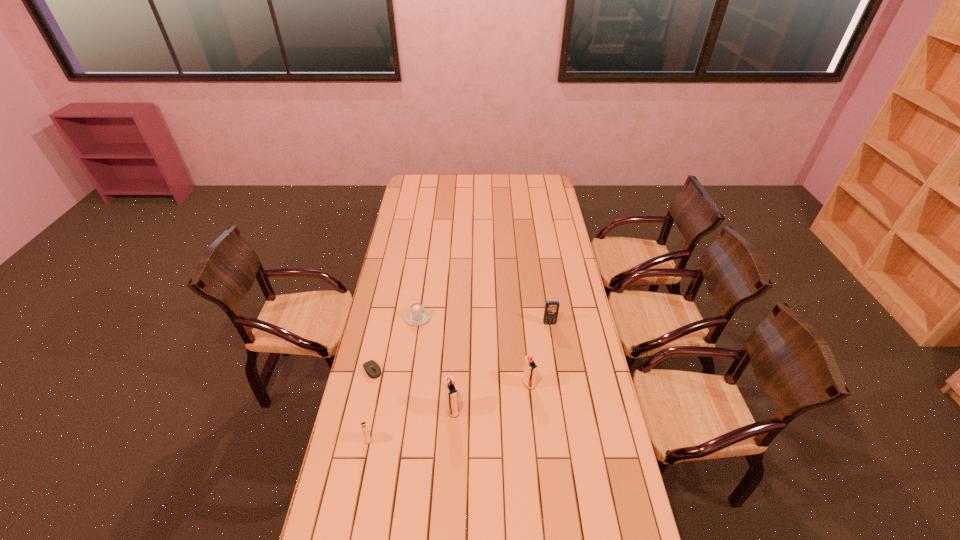
Where is `free space between the farthest igniter and the third object from right to left`? Image resolution: width=960 pixels, height=540 pixels. free space between the farthest igniter and the third object from right to left is located at coordinates (491, 397).

In order to click on unoccupied area between the cappuccino and the fifth object from left to right in this screenshot , I will do `click(473, 351)`.

Find the location of a particular element. vacant space that is in between the second farthest igniter and the nearest object is located at coordinates (410, 425).

The image size is (960, 540). I want to click on free space between the fourth object from right to left and the shortest object, so click(x=396, y=344).

The height and width of the screenshot is (540, 960). I want to click on vacant region between the computer equipment and the second farthest igniter, so click(413, 390).

Locate an element on the screen. vacant point located between the third object from right to left and the rightmost object is located at coordinates (501, 367).

At what (x,y) coordinates should I click in order to perform the action: click on object that is the nearest to the cellular telephone. Please return your answer as a coordinate pair (x, y). Image resolution: width=960 pixels, height=540 pixels. Looking at the image, I should click on (530, 368).

Identify which object is the fourth closest to the third object from right to left. Please provide its 2D coordinates. Your answer should be formatted as a tuple, i.e. [(x, y)], where the tuple contains the x and y coordinates of a point satisfying the conditions above.

[(417, 315)]

Identify which igniter is the second nearest to the cappuccino. Please provide its 2D coordinates. Your answer should be formatted as a tuple, i.e. [(x, y)], where the tuple contains the x and y coordinates of a point satisfying the conditions above.

[(530, 368)]

Identify which igniter is located as the second nearest to the cappuccino. Please provide its 2D coordinates. Your answer should be formatted as a tuple, i.e. [(x, y)], where the tuple contains the x and y coordinates of a point satisfying the conditions above.

[(530, 368)]